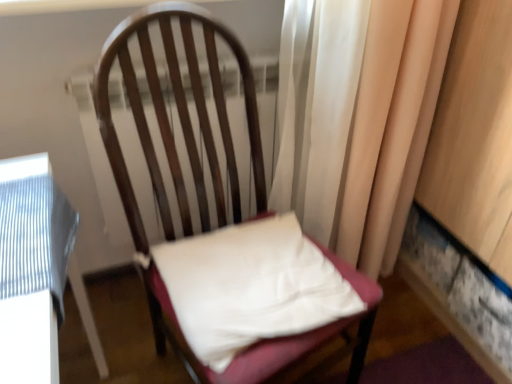
Question: From the image's perspective, is wooden chair at center positioned above or below white fabric pillow at center?

Choices:
 (A) above
 (B) below

Answer: (A)

Question: Considering the positions of wooden chair at center and white fabric pillow at center in the image, is wooden chair at center bigger or smaller than white fabric pillow at center?

Choices:
 (A) small
 (B) big

Answer: (B)

Question: Which of these objects is positioned farthest from the white fabric pillow at center?

Choices:
 (A) silky beige curtain at right
 (B) wooden chair at center

Answer: (A)

Question: Which object is positioned closest to the silky beige curtain at right?

Choices:
 (A) white fabric pillow at center
 (B) wooden chair at center

Answer: (B)